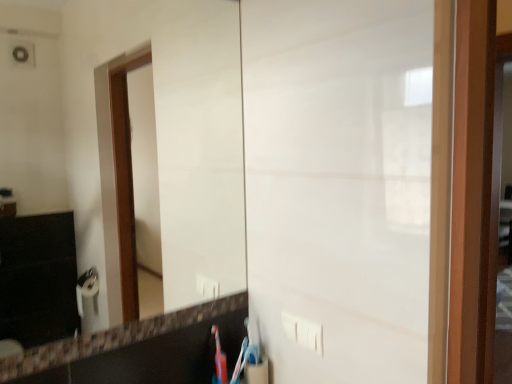
The image size is (512, 384). What do you see at coordinates (303, 332) in the screenshot?
I see `white plastic electric outlet at lower center` at bounding box center [303, 332].

This screenshot has width=512, height=384. What do you see at coordinates (136, 180) in the screenshot? I see `white glossy mirror at center` at bounding box center [136, 180].

The image size is (512, 384). I want to click on white plastic electric outlet at lower center, so click(x=303, y=332).

Locate an element on the screen. The width and height of the screenshot is (512, 384). electric outlet behind the white glossy mirror at center is located at coordinates (303, 332).

Is the depth of white glossy mirror at center less than that of white plastic electric outlet at lower center?

Yes, white glossy mirror at center is in front of white plastic electric outlet at lower center.

Is white glossy mirror at center surrounding white plastic electric outlet at lower center?

Actually, white plastic electric outlet at lower center is outside white glossy mirror at center.

Is white glossy mirror at center next to white plastic electric outlet at lower center and touching it?

No, white glossy mirror at center is not beside white plastic electric outlet at lower center.

Between white glossy mirror at center and blue plastic toothbrush at lower center, which one has less height?

blue plastic toothbrush at lower center.

Is white glossy mirror at center in front of blue plastic toothbrush at lower center?

Yes, it is in front of blue plastic toothbrush at lower center.

Which object is wider, white glossy mirror at center or blue plastic toothbrush at lower center?

Wider between the two is blue plastic toothbrush at lower center.

From a real-world perspective, which is physically above, white glossy mirror at center or blue plastic toothbrush at lower center?

In real-world perspective, white glossy mirror at center is above.

Is white plastic electric outlet at lower center completely or partially outside of blue plastic toothbrush at lower center?

Indeed, white plastic electric outlet at lower center is completely outside blue plastic toothbrush at lower center.

Is white plastic electric outlet at lower center taller than blue plastic toothbrush at lower center?

No.

From a real-world perspective, is white plastic electric outlet at lower center on blue plastic toothbrush at lower center?

Yes.

Is white plastic electric outlet at lower center far away from blue plastic toothbrush at lower center?

No, white plastic electric outlet at lower center is not far from blue plastic toothbrush at lower center.

Which is more to the right, white plastic electric outlet at lower center or white glossy mirror at center?

From the viewer's perspective, white plastic electric outlet at lower center appears more on the right side.

From the image's perspective, which is above, white plastic electric outlet at lower center or white glossy mirror at center?

From the image's view, white glossy mirror at center is above.

From the picture: Is white plastic electric outlet at lower center in front of or behind white glossy mirror at center in the image?

white plastic electric outlet at lower center is behind white glossy mirror at center.

Consider the image. Would you say white plastic electric outlet at lower center is outside white glossy mirror at center?

That's correct, white plastic electric outlet at lower center is outside of white glossy mirror at center.

Is blue plastic toothbrush at lower center far from white glossy mirror at center?

blue plastic toothbrush at lower center is far away from white glossy mirror at center.

Which object is further away from the camera, blue plastic toothbrush at lower center or white glossy mirror at center?

blue plastic toothbrush at lower center is further away from the camera.

From the image's perspective, is blue plastic toothbrush at lower center positioned above or below white glossy mirror at center?

Clearly, from the image's perspective, blue plastic toothbrush at lower center is below white glossy mirror at center.

Can you tell me how much blue plastic toothbrush at lower center and white glossy mirror at center differ in facing direction?

The angular difference between blue plastic toothbrush at lower center and white glossy mirror at center is 0.59 degrees.

Find the location of a particular element. The width and height of the screenshot is (512, 384). electric outlet above the blue plastic toothbrush at lower center (from a real-world perspective) is located at coordinates (303, 332).

Can you confirm if blue plastic toothbrush at lower center is thinner than white plastic electric outlet at lower center?

In fact, blue plastic toothbrush at lower center might be wider than white plastic electric outlet at lower center.

Is blue plastic toothbrush at lower center positioned far away from white plastic electric outlet at lower center?

Actually, blue plastic toothbrush at lower center and white plastic electric outlet at lower center are a little close together.

Is point (254, 351) positioned before point (320, 340)?

No.

At what (x,y) coordinates should I click in order to perform the action: click on electric outlet that appears on the right of white glossy mirror at center. Please return your answer as a coordinate pair (x, y). Looking at the image, I should click on (303, 332).

Where is `toothbrush behind the white glossy mirror at center`? The height and width of the screenshot is (384, 512). toothbrush behind the white glossy mirror at center is located at coordinates (251, 348).

From the image, which object appears to be farther from white plastic electric outlet at lower center, blue plastic toothbrush at lower center or white glossy mirror at center?

white glossy mirror at center is positioned further to the anchor white plastic electric outlet at lower center.

Which object lies nearer to the anchor point blue plastic toothbrush at lower center, white plastic electric outlet at lower center or white glossy mirror at center?

The object closer to blue plastic toothbrush at lower center is white plastic electric outlet at lower center.

Considering their positions, is white glossy mirror at center positioned further to white plastic electric outlet at lower center than blue plastic toothbrush at lower center?

Based on the image, white glossy mirror at center appears to be further to white plastic electric outlet at lower center.

Based on their spatial positions, is white plastic electric outlet at lower center or blue plastic toothbrush at lower center further from white glossy mirror at center?

white plastic electric outlet at lower center is further to white glossy mirror at center.

When comparing their distances from white glossy mirror at center, does blue plastic toothbrush at lower center or white plastic electric outlet at lower center seem closer?

blue plastic toothbrush at lower center is positioned closer to the anchor white glossy mirror at center.

When comparing their distances from blue plastic toothbrush at lower center, does white glossy mirror at center or white plastic electric outlet at lower center seem closer?

white plastic electric outlet at lower center is closer to blue plastic toothbrush at lower center.

Where is `electric outlet between white glossy mirror at center and blue plastic toothbrush at lower center from top to bottom`? This screenshot has width=512, height=384. electric outlet between white glossy mirror at center and blue plastic toothbrush at lower center from top to bottom is located at coordinates (303, 332).